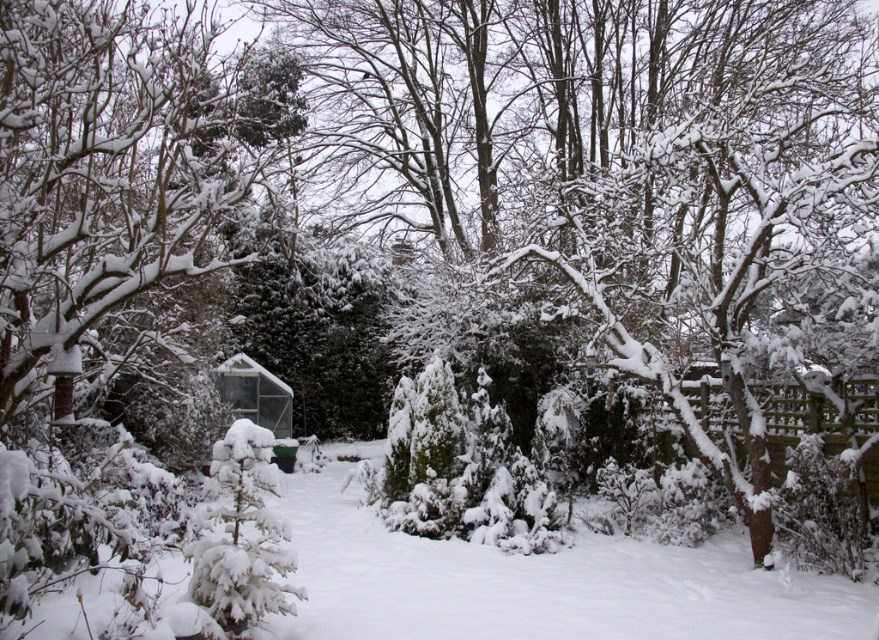
You are standing in the winter garden and want to take a photo of both point (78, 172) and point (258, 385). Which point should you focus on first to ensure both are in sharp focus?

You should focus on point (78, 172) first because it is closer to the camera than point (258, 385). This ensures the closer point is in focus, and the farther point will also be within the depth of field.

You are standing in the winter garden and see a point marked at coordinates (99,232). What object does this point correspond to?

The point at coordinates (99,232) corresponds to the snow covered evergreen tree at left.